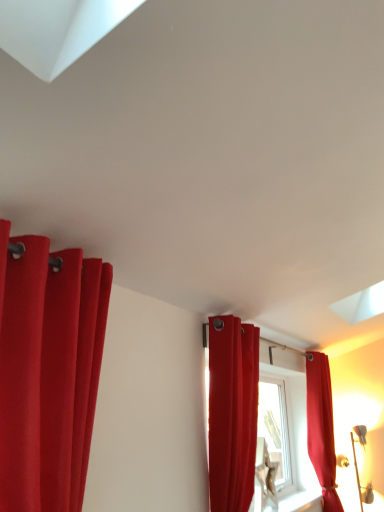
Question: Considering the positions of matte red curtain at left, the 1th curtain from the left, and matte red curtain at right, the 1th curtain from the right, in the image, is matte red curtain at left, the 1th curtain from the left, taller or shorter than matte red curtain at right, the 1th curtain from the right,?

Choices:
 (A) tall
 (B) short

Answer: (B)

Question: Is matte red curtain at left, arranged as the 3th curtain when viewed from the right, wider or thinner than matte red curtain at right, the 1th curtain from the right?

Choices:
 (A) thin
 (B) wide

Answer: (A)

Question: Which object is positioned farthest from the matte red curtain at left, which ranks as the third curtain in back-to-front order?

Choices:
 (A) matte red curtain at right, placed as the 3th curtain when sorted from front to back
 (B) matte red curtain at center, which is counted as the 2th curtain, starting from the left

Answer: (A)

Question: Estimate the real-world distances between objects in this image. Which object is farther from the matte red curtain at right, the 1th curtain from the right?

Choices:
 (A) matte red curtain at left, the 1th curtain from the left
 (B) matte red curtain at center, which ranks as the 2th curtain in front-to-back order

Answer: (A)